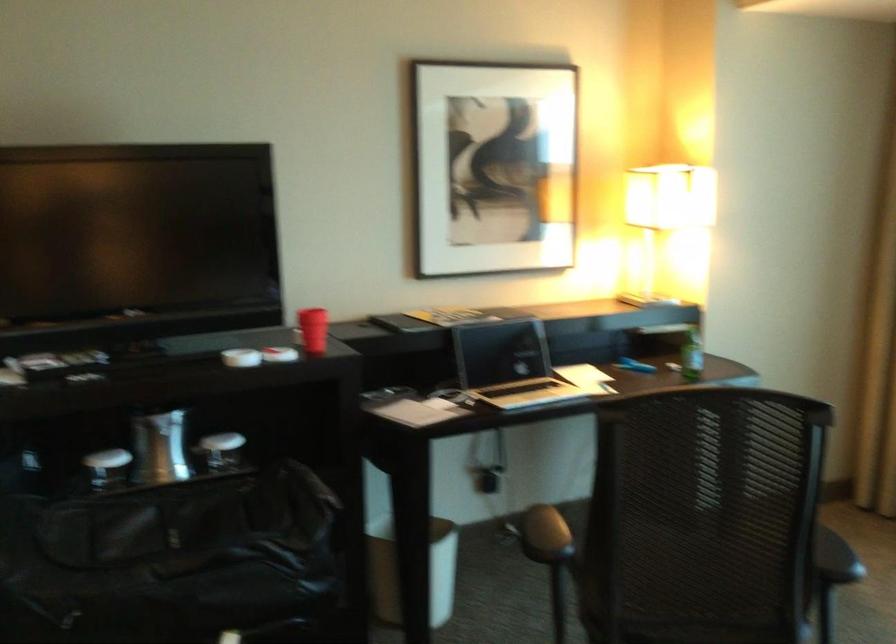
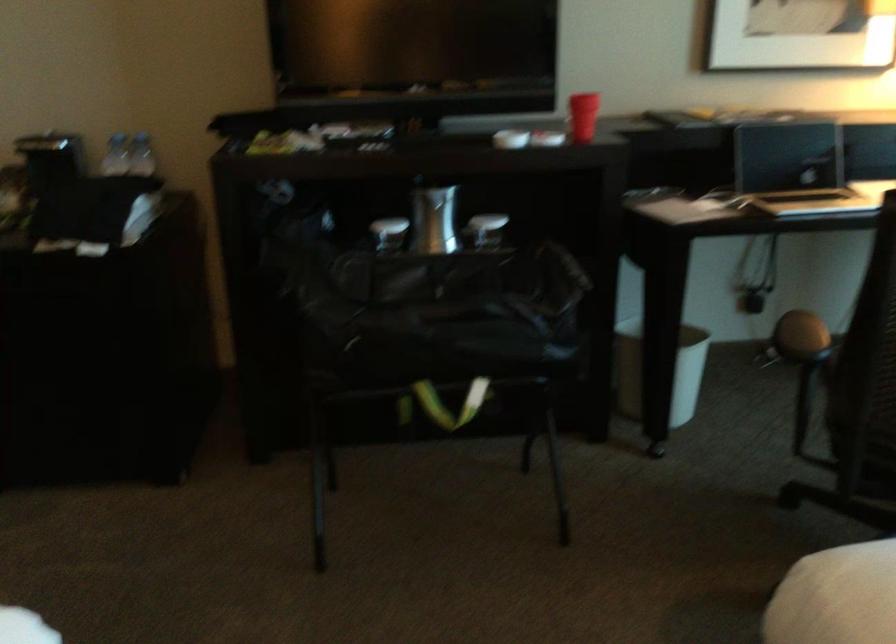
Where in the second image is the point corresponding to pixel 161 446 from the first image?

(433, 220)